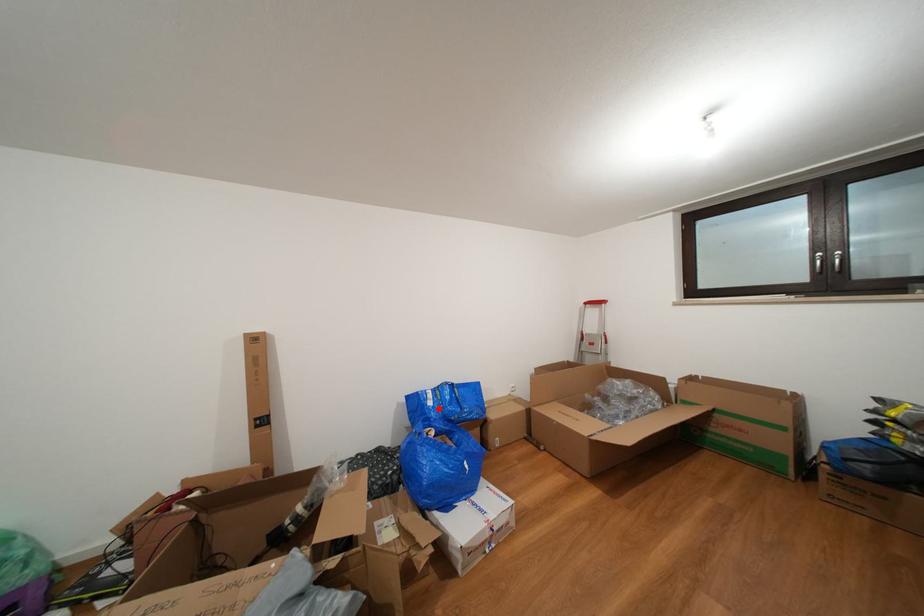
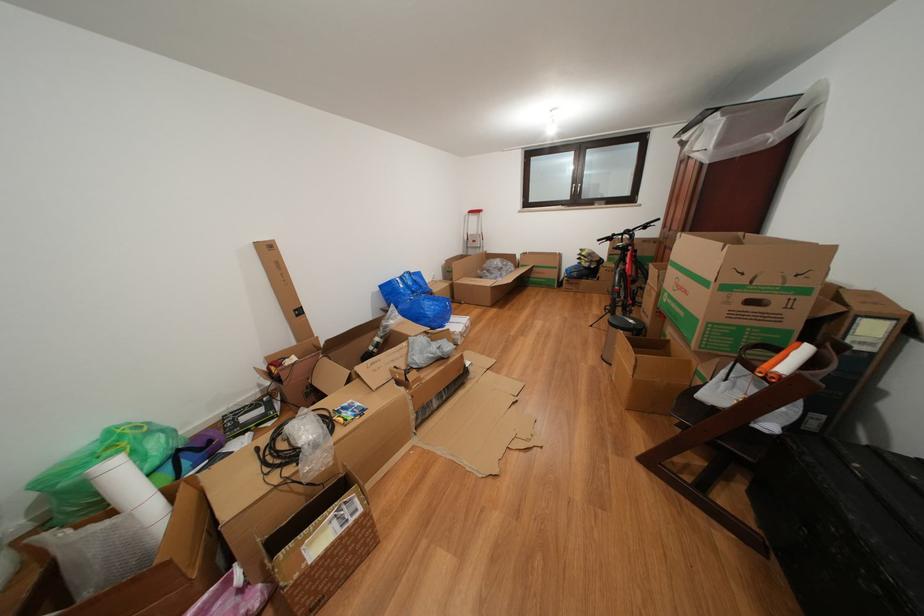
The point at the highlighted location is marked in the first image. Where is the corresponding point in the second image?

(409, 291)